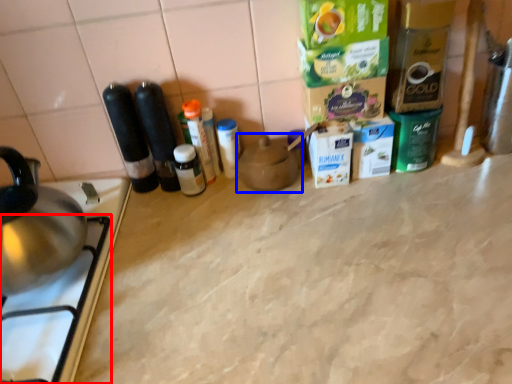
Question: Which point is closer to the camera, gas stove (highlighted by a red box) or appliance (highlighted by a blue box)?

Choices:
 (A) gas stove
 (B) appliance

Answer: (A)